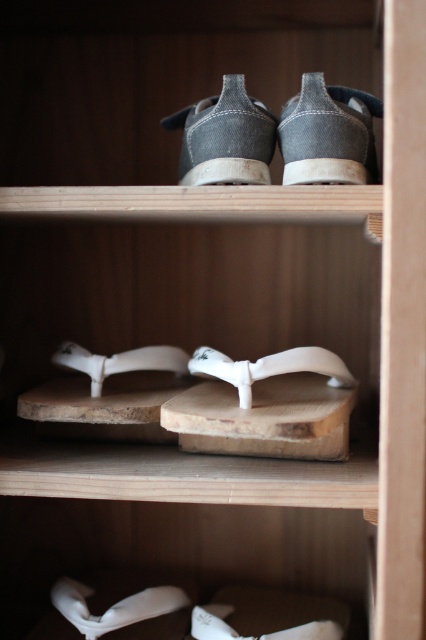
Question: Which point appears closest to the camera in this image?

Choices:
 (A) (360, 112)
 (B) (218, 376)
 (C) (241, 170)
 (D) (258, 433)

Answer: (D)

Question: Is dark gray canvas shoe at upper center in front of white matte sandal at center?

Choices:
 (A) yes
 (B) no

Answer: (A)

Question: Can you confirm if dark gray canvas shoe at upper center is positioned below white matte sandal at center?

Choices:
 (A) no
 (B) yes

Answer: (A)

Question: Estimate the real-world distances between objects in this image. Which object is closer to the natural wood sandal at center?

Choices:
 (A) white matte sandal at center
 (B) denim canvas sneaker at upper center
 (C) white rubber sandal at center

Answer: (C)

Question: Can you confirm if natural wood sandal at center is wider than white rubber sandal at center?

Choices:
 (A) no
 (B) yes

Answer: (B)

Question: Among these points, which one is farthest from the camera?

Choices:
 (A) (345, 102)
 (B) (250, 369)

Answer: (A)